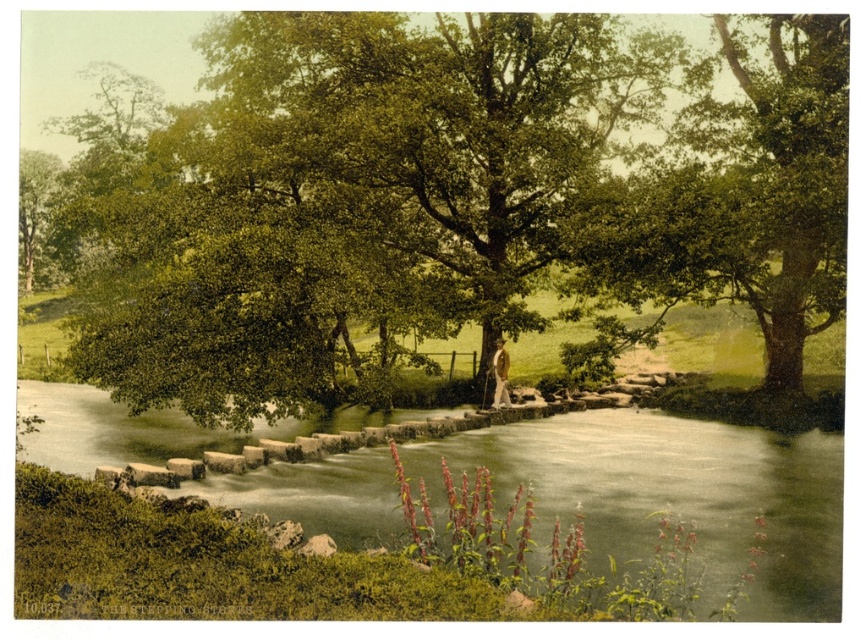
Question: Which point is closer to the camera taking this photo?

Choices:
 (A) (294, 138)
 (B) (705, 97)

Answer: (A)

Question: Does green leafy tree at center appear on the left side of smooth stone steps at center?

Choices:
 (A) no
 (B) yes

Answer: (B)

Question: Which of these objects is positioned closest to the green leafy tree at center?

Choices:
 (A) smooth stone steps at center
 (B) green leafy tree at upper right

Answer: (B)

Question: Observing the image, what is the correct spatial positioning of smooth stone steps at center in reference to green leafy tree at upper right?

Choices:
 (A) left
 (B) right

Answer: (A)

Question: Is the position of green leafy tree at center more distant than that of green leafy tree at upper right?

Choices:
 (A) no
 (B) yes

Answer: (B)

Question: Among these points, which one is nearest to the camera?

Choices:
 (A) (398, 140)
 (B) (786, 253)
 (C) (101, 428)

Answer: (A)